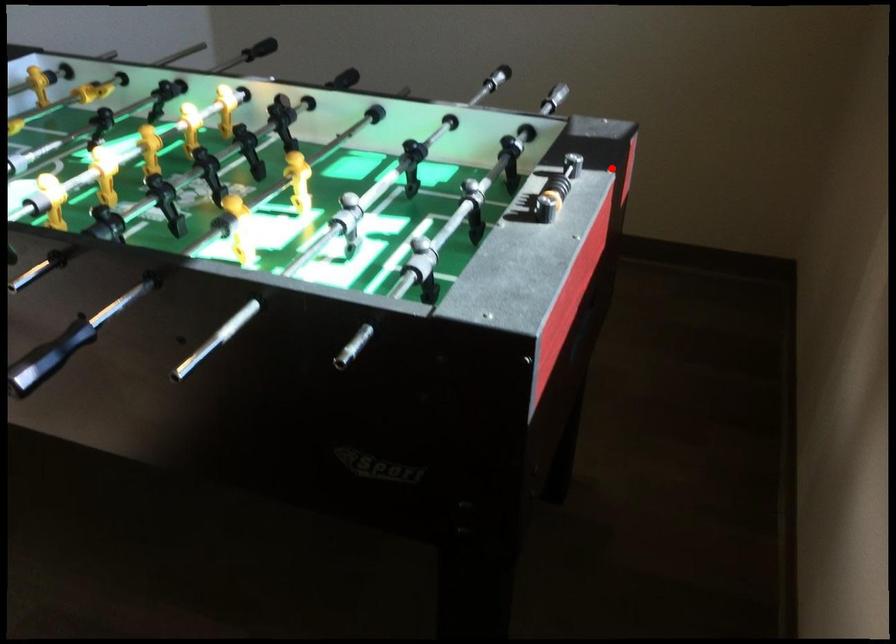
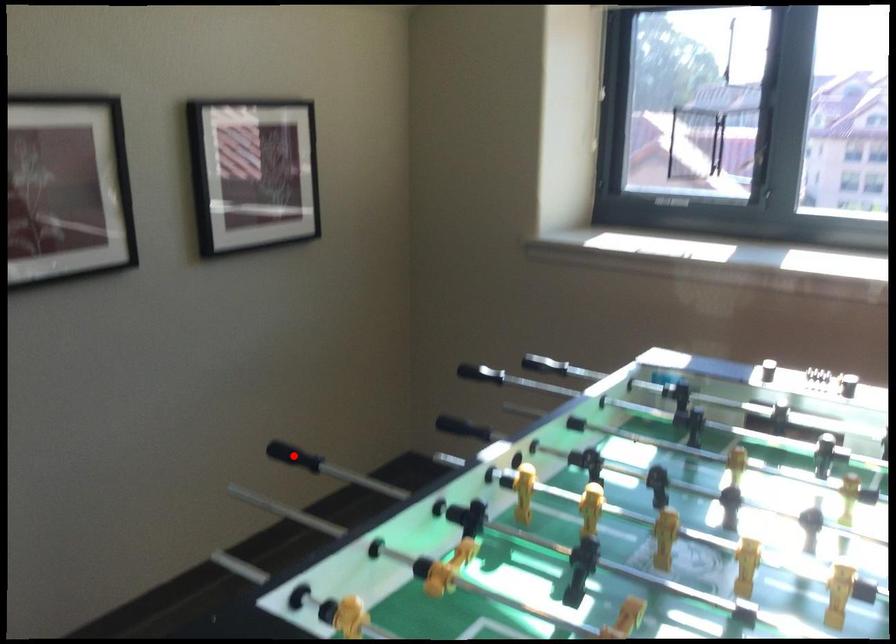
I am providing you with two images of the same scene from different viewpoints. A red point is marked on the first image and another point is marked on the second image. Are the points marked in image1 and image2 representing the same 3D position?

Yes